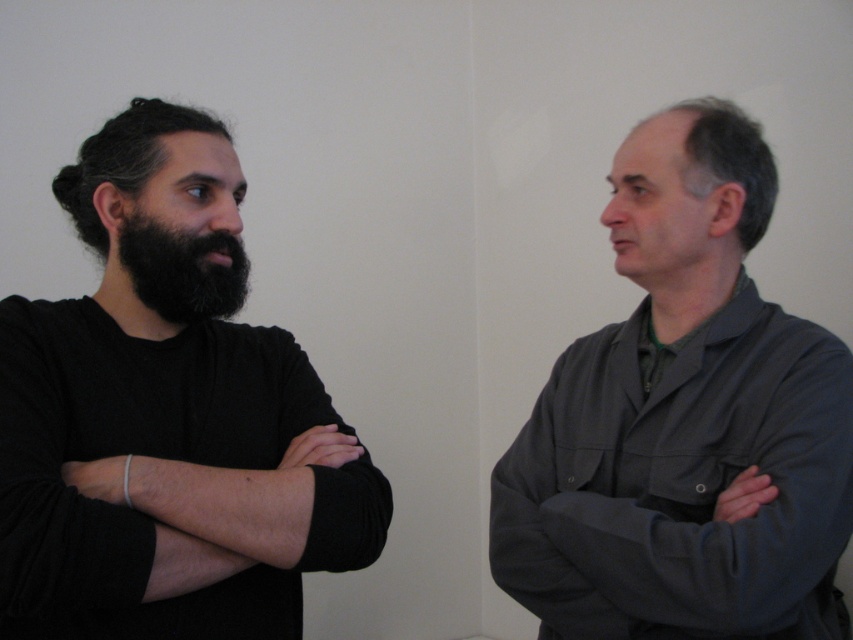
Question: Which point is farther to the camera?

Choices:
 (A) dark gray fabric shirt at right
 (B) black knitted sweater at left
 (C) black fuzzy beard at left

Answer: (C)

Question: Among these objects, which one is farthest from the camera?

Choices:
 (A) black knitted sweater at left
 (B) dark gray fabric shirt at right

Answer: (B)

Question: Estimate the real-world distances between objects in this image. Which object is farther from the dark gray fabric shirt at right?

Choices:
 (A) black knitted sweater at left
 (B) black fuzzy beard at left

Answer: (B)

Question: Can you confirm if black knitted sweater at left is positioned to the right of dark gray fabric shirt at right?

Choices:
 (A) no
 (B) yes

Answer: (A)

Question: Is black knitted sweater at left to the right of dark gray fabric shirt at right from the viewer's perspective?

Choices:
 (A) yes
 (B) no

Answer: (B)

Question: Can you confirm if dark gray fabric shirt at right is positioned to the left of black fuzzy beard at left?

Choices:
 (A) no
 (B) yes

Answer: (A)